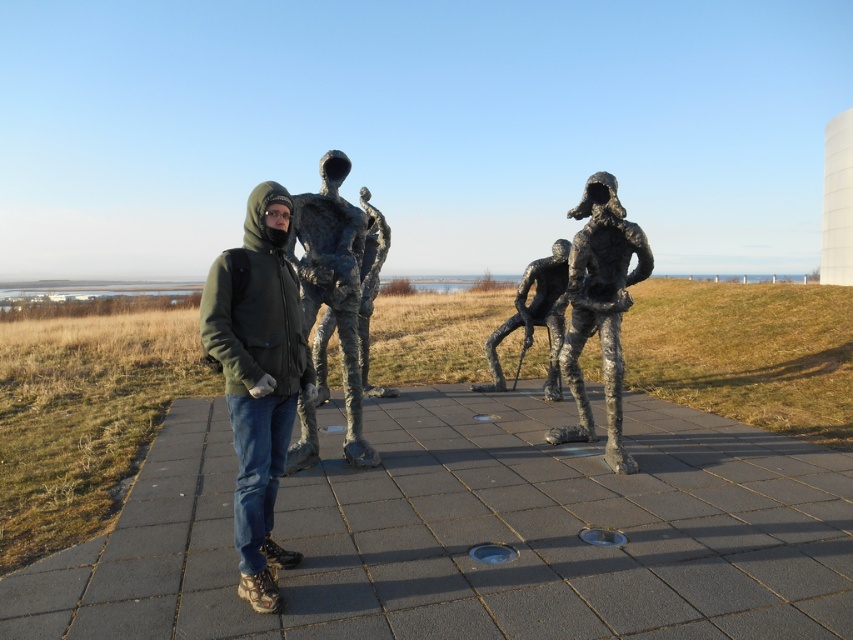
Question: Which of the following is the closest to the observer?

Choices:
 (A) green matte jacket at center
 (B) shiny bronze statue at center
 (C) gray concrete pavement at center

Answer: (A)

Question: Which point is closer to the camera?

Choices:
 (A) polished bronze figure at center
 (B) green matte jacket at center
 (C) bronze textured figure at center

Answer: (B)

Question: Which object is the closest to the bronze textured figure at center?

Choices:
 (A) polished bronze figure at center
 (B) shiny bronze statue at center

Answer: (A)

Question: Can you confirm if bronze textured figure at center is positioned to the right of shiny bronze statue at center?

Choices:
 (A) no
 (B) yes

Answer: (B)

Question: Is green matte jacket at center above shiny bronze statue at center?

Choices:
 (A) yes
 (B) no

Answer: (B)

Question: Does green matte jacket at center lie in front of bronze textured figure at center?

Choices:
 (A) yes
 (B) no

Answer: (A)